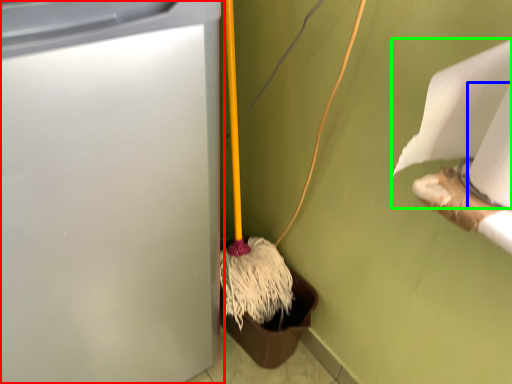
Question: Which object is positioned closest to waste container (highlighted by a red box)? Select from toilet paper (highlighted by a blue box) and toilet paper (highlighted by a green box).

Choices:
 (A) toilet paper
 (B) toilet paper

Answer: (B)